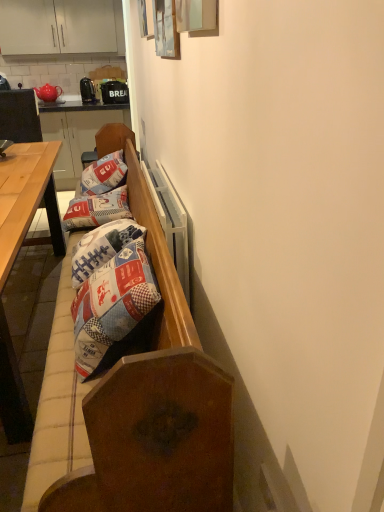
Question: Is light brown wooden table at left to the right of patchwork fabric pillow at center, which is the first pillow in back-to-front order, from the viewer's perspective?

Choices:
 (A) no
 (B) yes

Answer: (A)

Question: Is light brown wooden table at left not close to patchwork fabric pillow at center, which is the first pillow in back-to-front order?

Choices:
 (A) yes
 (B) no

Answer: (B)

Question: From the image's perspective, is light brown wooden table at left on patchwork fabric pillow at center, which is the first pillow in back-to-front order?

Choices:
 (A) no
 (B) yes

Answer: (B)

Question: Can you confirm if light brown wooden table at left is bigger than patchwork fabric pillow at center, the 2th pillow viewed from the front?

Choices:
 (A) yes
 (B) no

Answer: (A)

Question: From the image's perspective, is light brown wooden table at left located beneath patchwork fabric pillow at center, the 2th pillow viewed from the front?

Choices:
 (A) no
 (B) yes

Answer: (A)

Question: From a real-world perspective, is light brown wooden table at left above or below wooden bench at center?

Choices:
 (A) above
 (B) below

Answer: (A)

Question: In the image, is light brown wooden table at left on the left side or the right side of wooden bench at center?

Choices:
 (A) left
 (B) right

Answer: (A)

Question: Does point coord(61,239) appear closer or farther from the camera than point coord(69,318)?

Choices:
 (A) farther
 (B) closer

Answer: (A)

Question: Is light brown wooden table at left situated inside wooden bench at center or outside?

Choices:
 (A) outside
 (B) inside

Answer: (A)

Question: Choose the correct answer: Is patchwork fabric pillow at center, which is the first pillow from front to back, inside wooden desk at left or outside it?

Choices:
 (A) outside
 (B) inside

Answer: (A)

Question: In the image, is patchwork fabric pillow at center, positioned as the second pillow in back-to-front order, positioned in front of or behind wooden desk at left?

Choices:
 (A) front
 (B) behind

Answer: (B)

Question: Considering the positions of point (114, 202) and point (18, 151), is point (114, 202) closer or farther from the camera than point (18, 151)?

Choices:
 (A) farther
 (B) closer

Answer: (B)

Question: Based on their sizes in the image, would you say patchwork fabric pillow at center, which is the first pillow from front to back, is bigger or smaller than wooden desk at left?

Choices:
 (A) big
 (B) small

Answer: (B)

Question: Relative to patchwork fabric pillow at center, positioned as the second pillow in back-to-front order, is wooden bench at left in front or behind?

Choices:
 (A) behind
 (B) front

Answer: (A)

Question: Is point (82, 132) positioned closer to the camera than point (69, 222)?

Choices:
 (A) closer
 (B) farther

Answer: (B)